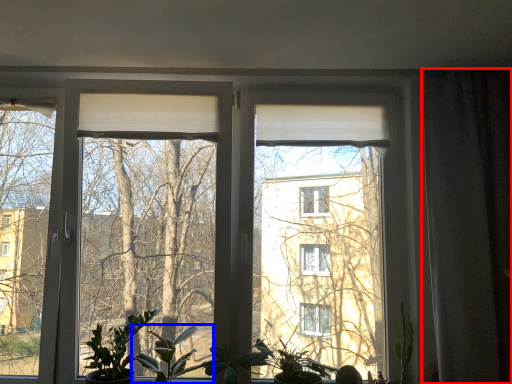
Question: Which point is closer to the camera, curtain (highlighted by a red box) or houseplant (highlighted by a blue box)?

Choices:
 (A) curtain
 (B) houseplant

Answer: (B)